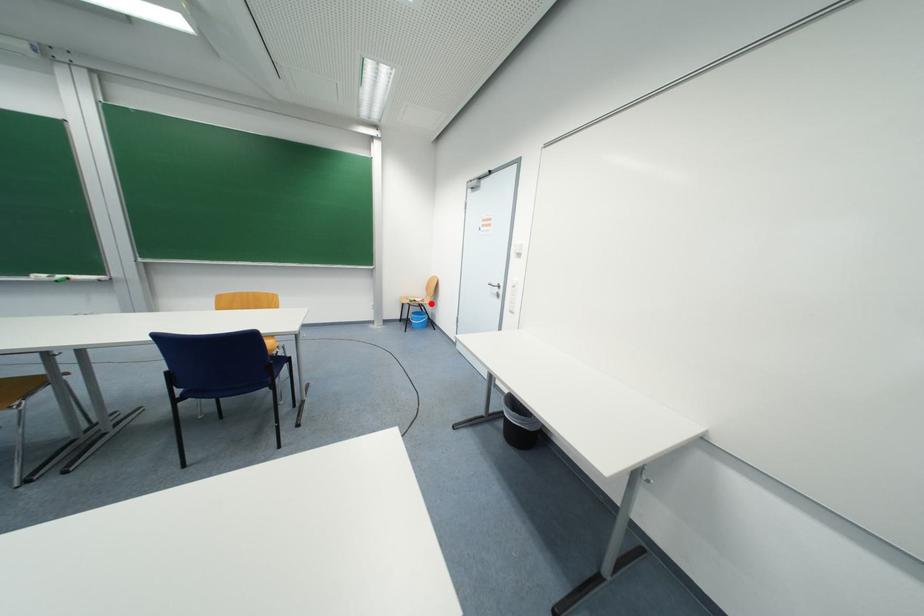
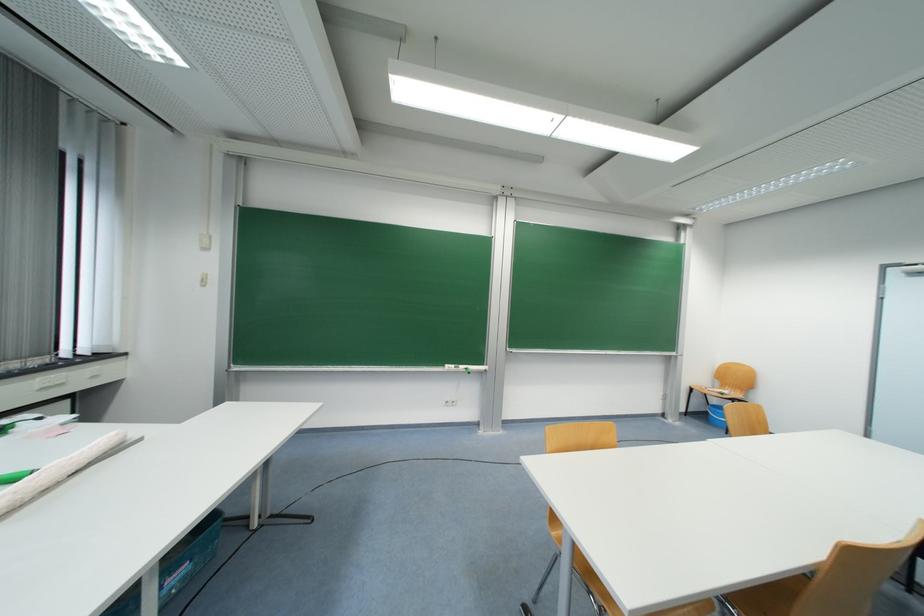
The point at the highlighted location is marked in the first image. Where is the corresponding point in the second image?

(743, 398)